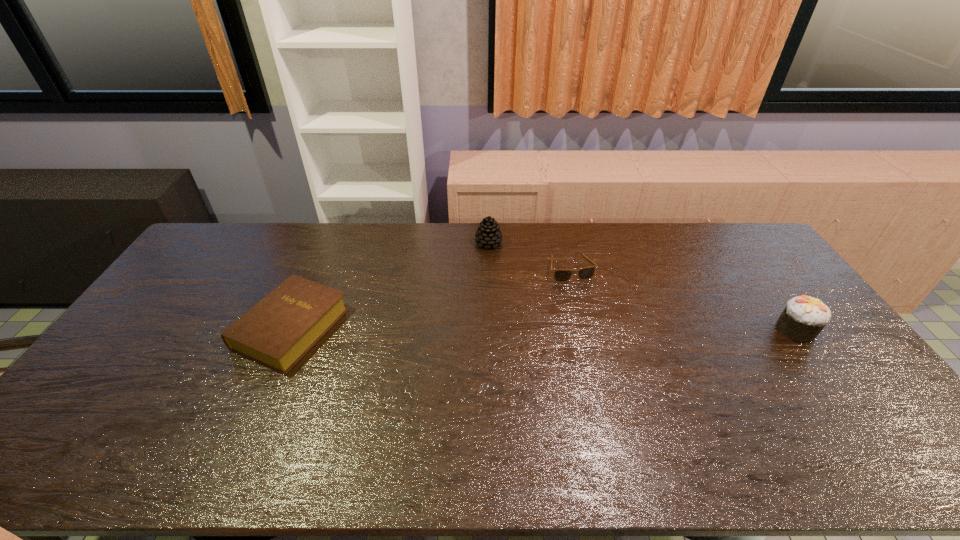
You are a GUI agent. You are given a task and a screenshot of the screen. Output one action in this format:
    pyautogui.click(x=<x>, y=<y>)
    Task: Click on the Bible
    The width and height of the screenshot is (960, 540).
    Given the screenshot: What is the action you would take?
    pyautogui.click(x=279, y=330)

Find the location of `the leftmost object`. the leftmost object is located at coordinates (279, 330).

I want to click on the rightmost object, so click(804, 317).

Where is `the second object from left to right`? The height and width of the screenshot is (540, 960). the second object from left to right is located at coordinates (488, 233).

Where is `the farthest object`? the farthest object is located at coordinates (x=488, y=233).

Where is `the second farthest object`? the second farthest object is located at coordinates (560, 275).

This screenshot has height=540, width=960. I want to click on sunglasses, so click(560, 275).

This screenshot has height=540, width=960. What are the coordinates of `vacant space located on the back of the Bible` in the screenshot? It's located at (318, 268).

This screenshot has width=960, height=540. I want to click on free region located 0.340m on the back of the cupcake, so click(x=738, y=249).

Locate an element on the screen. This screenshot has height=540, width=960. vacant space situated at the narrow end of the pinecone is located at coordinates (544, 299).